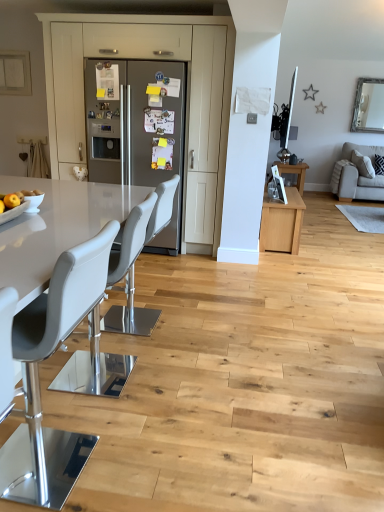
What are the coordinates of `unoccupied space behind gray leather bar stool at center, which is the second chair in back-to-front order` in the screenshot? It's located at (131, 343).